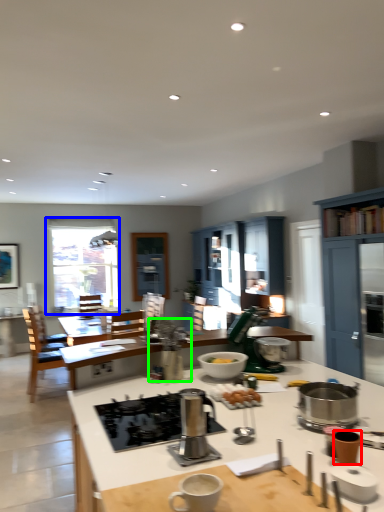
Question: Estimate the real-world distances between objects in this image. Which object is closer to appliance (highlighted by a red box), window (highlighted by a blue box) or appliance (highlighted by a green box)?

Choices:
 (A) window
 (B) appliance

Answer: (B)